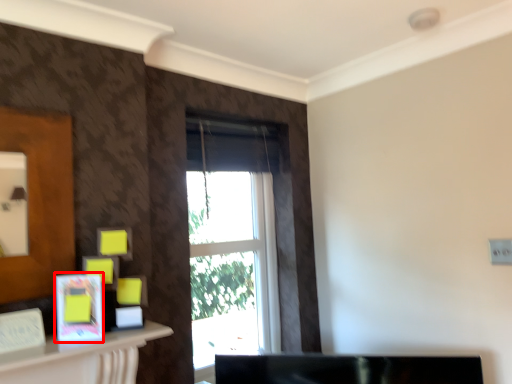
Question: From the image's perspective, where is picture frame (annotated by the red box) located relative to window?

Choices:
 (A) above
 (B) below

Answer: (B)